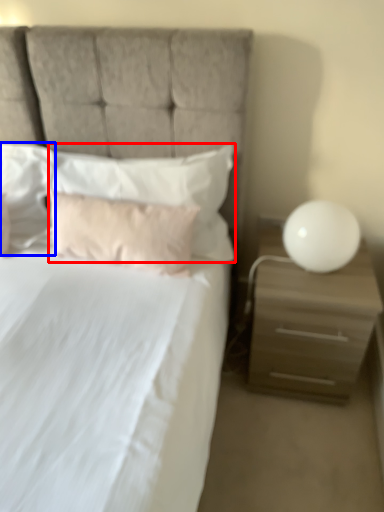
Question: Which object appears farthest to the camera in this image, pillow (highlighted by a red box) or pillow (highlighted by a blue box)?

Choices:
 (A) pillow
 (B) pillow

Answer: (B)